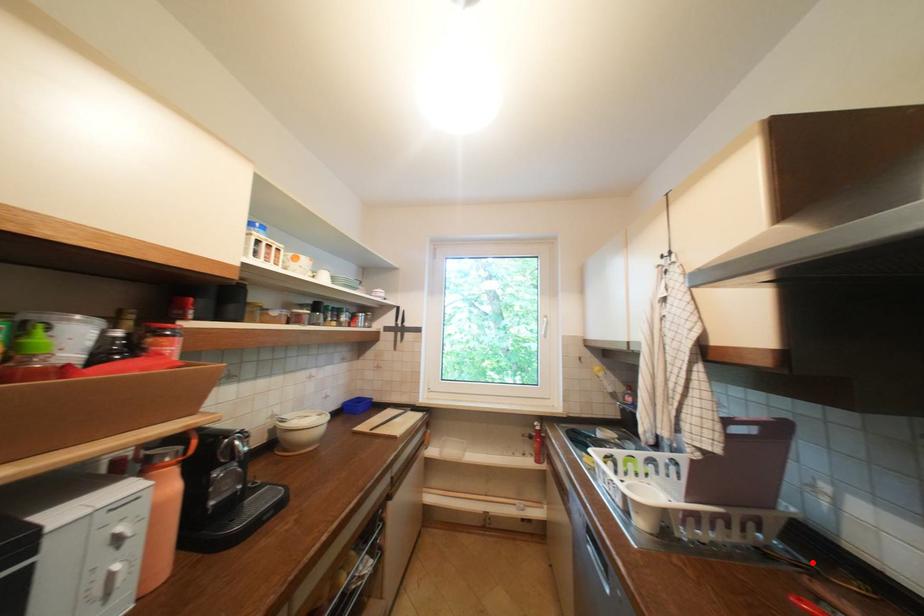
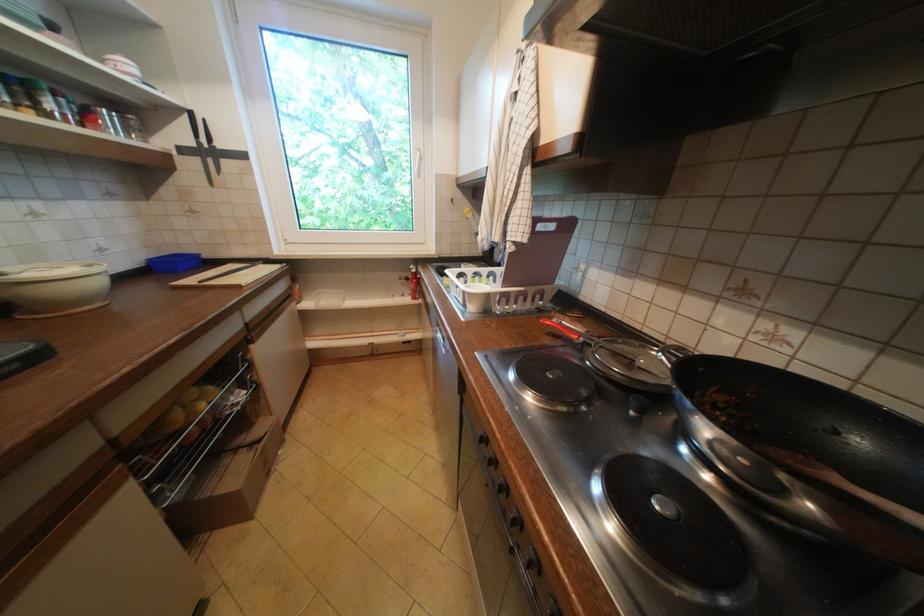
Question: I am providing you with two images of the same scene from different viewpoints. A red point is marked on the first image. Can you still see the location of the red point in image 2?

Choices:
 (A) Yes
 (B) No

Answer: (A)